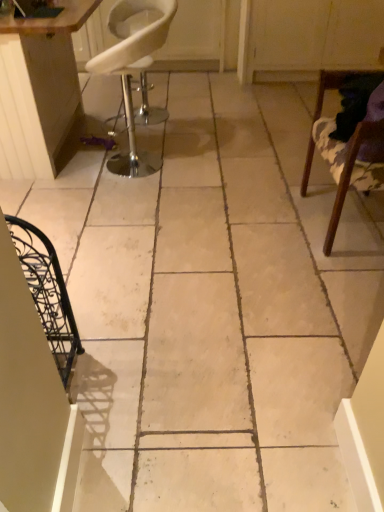
At what (x,y) coordinates should I click in order to perform the action: click on wooden chair at right, acting as the first chair starting from the right. Please return your answer as a coordinate pair (x, y). Looking at the image, I should click on (353, 169).

Where is `wooden table at upper left`? The height and width of the screenshot is (512, 384). wooden table at upper left is located at coordinates (39, 89).

You are a GUI agent. You are given a task and a screenshot of the screen. Output one action in this format:
    pyautogui.click(x=<x>, y=<y>)
    Task: Click on the white plastic chair at upper left, marked as the 2th chair in a right-to-left arrangement
    The image size is (384, 512).
    Given the screenshot: What is the action you would take?
    pyautogui.click(x=134, y=68)

Does point (329, 242) appear closer or farther from the camera than point (159, 15)?

Point (329, 242) appears to be closer to the viewer than point (159, 15).

Could you tell me if wooden chair at right, acting as the first chair starting from the right, is turned towards white plastic chair at upper left, marked as the 2th chair in a right-to-left arrangement?

No, wooden chair at right, acting as the first chair starting from the right, does not turn towards white plastic chair at upper left, marked as the 2th chair in a right-to-left arrangement.

Can you confirm if wooden chair at right, acting as the first chair starting from the right, is shorter than white plastic chair at upper left, marked as the 2th chair in a right-to-left arrangement?

Yes.

Considering the sizes of objects wooden chair at right, which ranks as the second chair in left-to-right order, and white plastic chair at upper left, which is counted as the first chair, starting from the left, in the image provided, who is wider, wooden chair at right, which ranks as the second chair in left-to-right order, or white plastic chair at upper left, which is counted as the first chair, starting from the left,?

white plastic chair at upper left, which is counted as the first chair, starting from the left.

Is white plastic chair at upper left, which is counted as the first chair, starting from the left, oriented towards wooden table at upper left?

Yes, white plastic chair at upper left, which is counted as the first chair, starting from the left, is aimed at wooden table at upper left.

Does white plastic chair at upper left, marked as the 2th chair in a right-to-left arrangement, appear on the left side of wooden table at upper left?

No.

Is white plastic chair at upper left, which is counted as the first chair, starting from the left, directly adjacent to wooden table at upper left?

white plastic chair at upper left, which is counted as the first chair, starting from the left, is not next to wooden table at upper left, and they're not touching.

Between white plastic chair at upper left, which is counted as the first chair, starting from the left, and wooden table at upper left, which one is positioned in front?

white plastic chair at upper left, which is counted as the first chair, starting from the left, is closer to the camera.

Are wooden table at upper left and white plastic chair at upper left, which is counted as the first chair, starting from the left, far apart?

Yes, wooden table at upper left and white plastic chair at upper left, which is counted as the first chair, starting from the left, are quite far apart.

Locate an element on the screen. table behind the white plastic chair at upper left, marked as the 2th chair in a right-to-left arrangement is located at coordinates (39, 89).

From the image's perspective, is wooden table at upper left under white plastic chair at upper left, marked as the 2th chair in a right-to-left arrangement?

No, from the image's perspective, wooden table at upper left is not below white plastic chair at upper left, marked as the 2th chair in a right-to-left arrangement.

Is wooden table at upper left bigger or smaller than white plastic chair at upper left, which is counted as the first chair, starting from the left?

Clearly, wooden table at upper left is larger in size than white plastic chair at upper left, which is counted as the first chair, starting from the left.

Is wooden chair at right, which ranks as the second chair in left-to-right order, aimed at wooden table at upper left?

No, wooden chair at right, which ranks as the second chair in left-to-right order, is not turned towards wooden table at upper left.

Who is shorter, wooden chair at right, acting as the first chair starting from the right, or wooden table at upper left?

Standing shorter between the two is wooden chair at right, acting as the first chair starting from the right.

Starting from the wooden table at upper left, which chair is the 2nd one in front? Please provide its 2D coordinates.

[(353, 169)]

Considering the relative sizes of wooden table at upper left and wooden chair at right, which ranks as the second chair in left-to-right order, in the image provided, is wooden table at upper left taller than wooden chair at right, which ranks as the second chair in left-to-right order,?

Yes.

Considering the relative sizes of wooden table at upper left and wooden chair at right, acting as the first chair starting from the right, in the image provided, is wooden table at upper left smaller than wooden chair at right, acting as the first chair starting from the right,?

Actually, wooden table at upper left might be larger than wooden chair at right, acting as the first chair starting from the right.

Based on the photo, could you tell me if wooden table at upper left is facing wooden chair at right, which ranks as the second chair in left-to-right order?

Yes.

How many degrees apart are the facing directions of wooden table at upper left and wooden chair at right, which ranks as the second chair in left-to-right order?

There is a 0.194-degree angle between the facing directions of wooden table at upper left and wooden chair at right, which ranks as the second chair in left-to-right order.

Is wooden chair at right, which ranks as the second chair in left-to-right order, at the back of white plastic chair at upper left, marked as the 2th chair in a right-to-left arrangement?

No, wooden chair at right, which ranks as the second chair in left-to-right order, is not at the back of white plastic chair at upper left, marked as the 2th chair in a right-to-left arrangement.

Considering the relative sizes of white plastic chair at upper left, marked as the 2th chair in a right-to-left arrangement, and wooden chair at right, which ranks as the second chair in left-to-right order, in the image provided, is white plastic chair at upper left, marked as the 2th chair in a right-to-left arrangement, bigger than wooden chair at right, which ranks as the second chair in left-to-right order,?

Indeed, white plastic chair at upper left, marked as the 2th chair in a right-to-left arrangement, has a larger size compared to wooden chair at right, which ranks as the second chair in left-to-right order.

Between white plastic chair at upper left, which is counted as the first chair, starting from the left, and wooden chair at right, which ranks as the second chair in left-to-right order, which one has larger width?

With larger width is white plastic chair at upper left, which is counted as the first chair, starting from the left.

Where is `chair to the right of white plastic chair at upper left, marked as the 2th chair in a right-to-left arrangement`? chair to the right of white plastic chair at upper left, marked as the 2th chair in a right-to-left arrangement is located at coordinates (353, 169).

From the wooden table at upper left, count 1st chairs forward and point to it. Please provide its 2D coordinates.

[(134, 68)]

Looking at the image, which one is located further to wooden chair at right, acting as the first chair starting from the right, white plastic chair at upper left, which is counted as the first chair, starting from the left, or wooden table at upper left?

white plastic chair at upper left, which is counted as the first chair, starting from the left, is further to wooden chair at right, acting as the first chair starting from the right.

Considering their positions, is wooden table at upper left positioned closer to wooden chair at right, which ranks as the second chair in left-to-right order, than white plastic chair at upper left, which is counted as the first chair, starting from the left?

wooden table at upper left lies closer to wooden chair at right, which ranks as the second chair in left-to-right order, than the other object.

Considering their positions, is wooden chair at right, acting as the first chair starting from the right, positioned closer to wooden table at upper left than white plastic chair at upper left, which is counted as the first chair, starting from the left?

Based on the image, wooden chair at right, acting as the first chair starting from the right, appears to be nearer to wooden table at upper left.

Which object lies further to the anchor point white plastic chair at upper left, which is counted as the first chair, starting from the left, wooden chair at right, acting as the first chair starting from the right, or wooden table at upper left?

Among the two, wooden chair at right, acting as the first chair starting from the right, is located further to white plastic chair at upper left, which is counted as the first chair, starting from the left.

Considering their positions, is white plastic chair at upper left, which is counted as the first chair, starting from the left, positioned closer to wooden table at upper left than wooden chair at right, acting as the first chair starting from the right?

wooden chair at right, acting as the first chair starting from the right.

When comparing their distances from white plastic chair at upper left, which is counted as the first chair, starting from the left, does wooden table at upper left or wooden chair at right, which ranks as the second chair in left-to-right order, seem further?

wooden chair at right, which ranks as the second chair in left-to-right order, is positioned further to the anchor white plastic chair at upper left, which is counted as the first chair, starting from the left.

You are a GUI agent. You are given a task and a screenshot of the screen. Output one action in this format:
    pyautogui.click(x=<x>, y=<y>)
    Task: Click on the chair between wooden table at upper left and wooden chair at right, which ranks as the second chair in left-to-right order
    This screenshot has height=512, width=384.
    Given the screenshot: What is the action you would take?
    pyautogui.click(x=134, y=68)